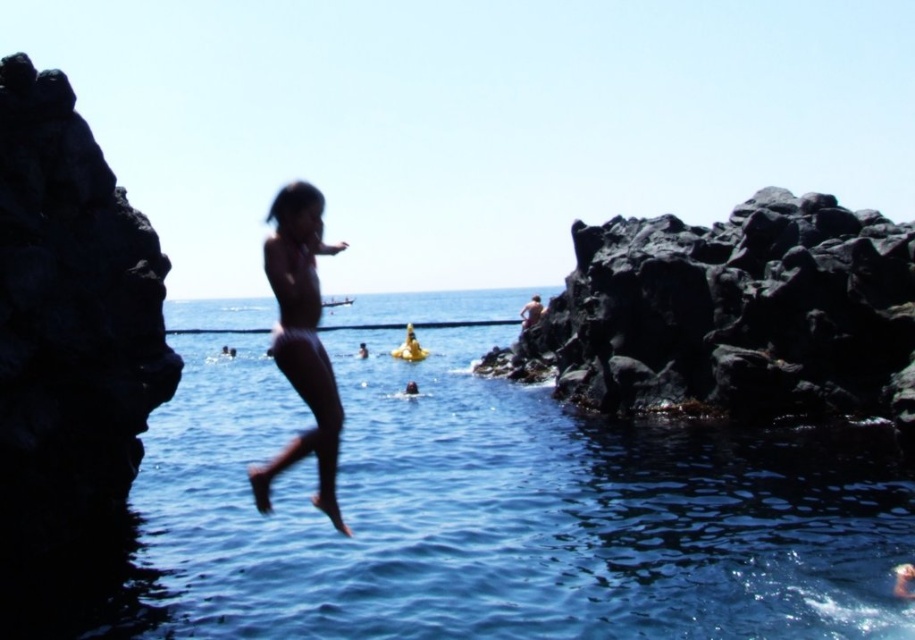
Question: Can you confirm if transparent blue water at center is positioned below smooth skin figure at center?

Choices:
 (A) no
 (B) yes

Answer: (B)

Question: Is smooth skin figure at center above smooth skin man at center?

Choices:
 (A) yes
 (B) no

Answer: (B)

Question: Which point is closer to the camera taking this photo?

Choices:
 (A) (539, 317)
 (B) (197, 593)
 (C) (289, 316)

Answer: (C)

Question: Which point is farther from the camera taking this photo?

Choices:
 (A) (245, 490)
 (B) (534, 317)
 (C) (318, 394)

Answer: (B)

Question: Which is nearer to the smooth skin figure at center?

Choices:
 (A) transparent blue water at center
 (B) smooth skin man at center

Answer: (A)

Question: Is transparent blue water at center above smooth skin man at center?

Choices:
 (A) no
 (B) yes

Answer: (A)